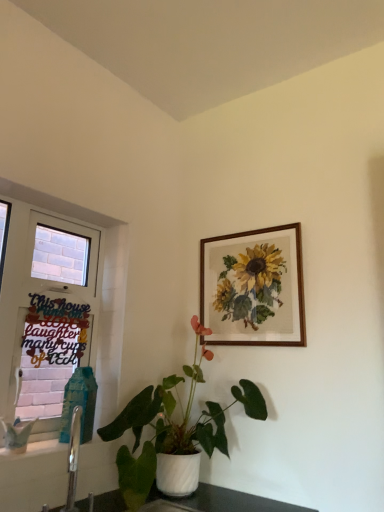
Image resolution: width=384 pixels, height=512 pixels. Identify the location of free space above white painted wood window at left (from a real-world perspective). (65, 214).